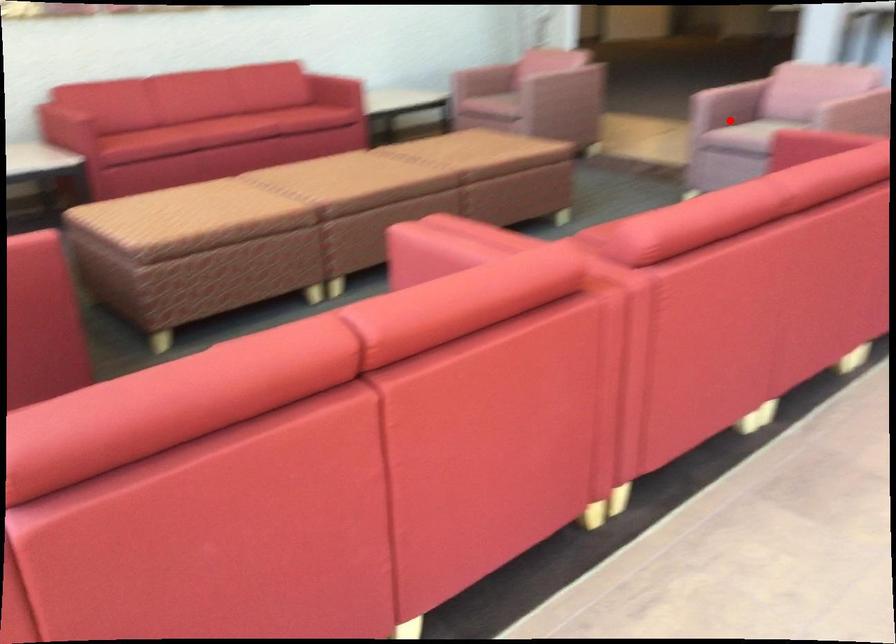
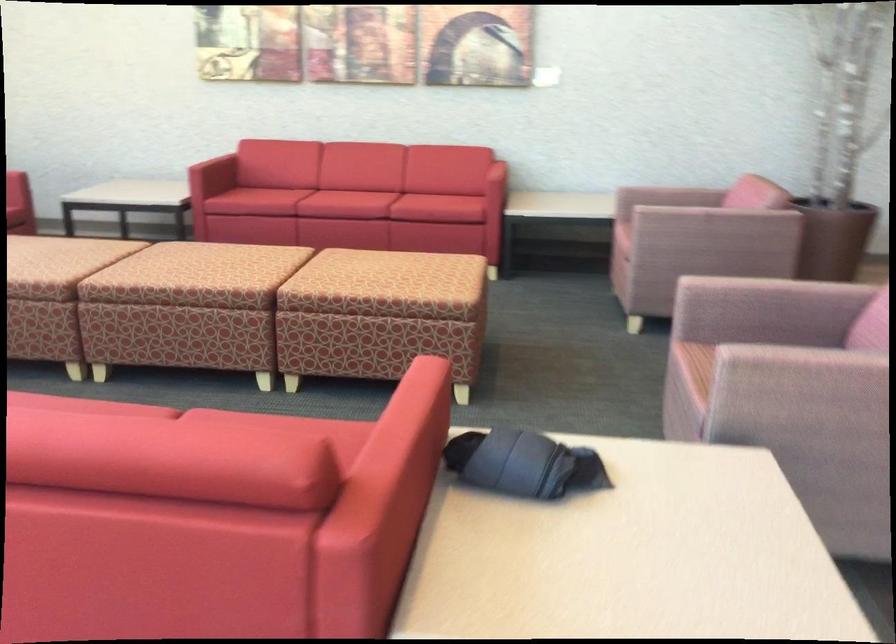
Find the pixel in the second image that matches the highlighted location in the first image.

(760, 330)